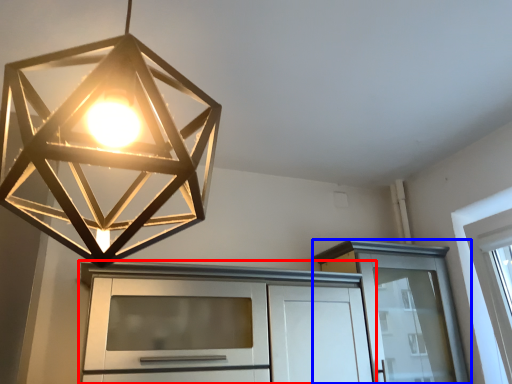
Question: Among these objects, which one is farthest to the camera, cabinetry (highlighted by a red box) or cabinetry (highlighted by a blue box)?

Choices:
 (A) cabinetry
 (B) cabinetry

Answer: (B)